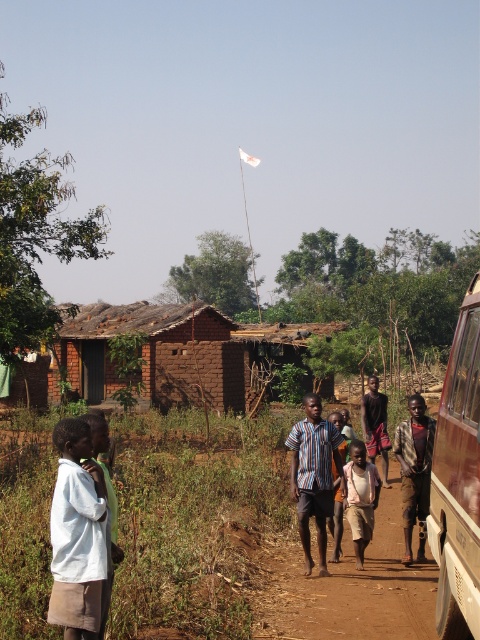
Question: Is rustic wood school bus at right closer to camera compared to light brown cotton shirt at center?

Choices:
 (A) no
 (B) yes

Answer: (B)

Question: Estimate the real-world distances between objects in this image. Which object is farther from the rustic wood school bus at right?

Choices:
 (A) brown woven cloth at center
 (B) light brown cotton shirt at center
 (C) white cotton shirt at lower left
 (D) striped cotton shirt at center

Answer: (C)

Question: Does light brown cotton shirt at center appear over dark brown fabric shirt at center?

Choices:
 (A) no
 (B) yes

Answer: (A)

Question: Can you confirm if rustic wood school bus at right is positioned to the left of white cotton shirt at lower left?

Choices:
 (A) no
 (B) yes

Answer: (A)

Question: Which point is closer to the camera?

Choices:
 (A) striped cotton shirt at center
 (B) dark brown fabric shirt at center

Answer: (A)

Question: Which point is farther to the camera?

Choices:
 (A) (365, 490)
 (B) (384, 448)

Answer: (B)